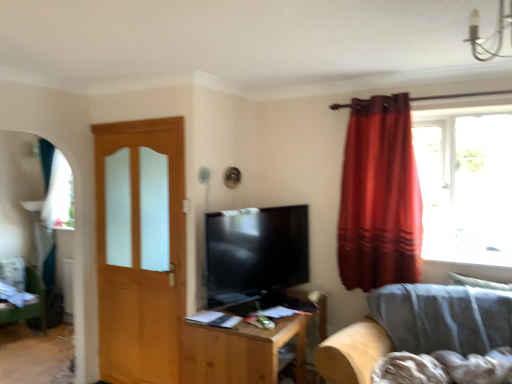
This screenshot has width=512, height=384. Describe the element at coordinates (140, 249) in the screenshot. I see `light brown wooden door at left` at that location.

Describe the element at coordinates (29, 304) in the screenshot. I see `green fabric swivel chair at lower left` at that location.

This screenshot has width=512, height=384. What do you see at coordinates (490, 35) in the screenshot?
I see `white glass chandelier at upper right` at bounding box center [490, 35].

This screenshot has height=384, width=512. What do you see at coordinates (248, 348) in the screenshot? I see `wooden table at center` at bounding box center [248, 348].

At what (x,y) coordinates should I click in order to perform the action: click on satin red curtain at right. Please return your answer as a coordinate pair (x, y). Looking at the image, I should click on (379, 196).

Consider the image. Does green fabric swivel chair at lower left turn towards satin red curtain at right?

No, green fabric swivel chair at lower left is not facing towards satin red curtain at right.

Which of these two, green fabric swivel chair at lower left or satin red curtain at right, is smaller?

Smaller between the two is satin red curtain at right.

In the scene shown: From the image's perspective, between green fabric swivel chair at lower left and satin red curtain at right, which one is located above?

satin red curtain at right.

Which object is thinner, green fabric swivel chair at lower left or satin red curtain at right?

Thinner between the two is satin red curtain at right.

Does satin red curtain at right have a greater width compared to light brown wooden door at left?

Yes.

The height and width of the screenshot is (384, 512). Find the location of `door below the satin red curtain at right (from the image's perspective)`. door below the satin red curtain at right (from the image's perspective) is located at coordinates (140, 249).

Considering the positions of point (349, 246) and point (131, 369), is point (349, 246) closer or farther from the camera than point (131, 369)?

Point (349, 246) is positioned closer to the camera compared to point (131, 369).

Measure the distance between satin red curtain at right and light brown wooden door at left.

A distance of 1.47 meters exists between satin red curtain at right and light brown wooden door at left.

Which is in front, gray fabric couch at lower right or light brown wooden door at left?

gray fabric couch at lower right is closer to the camera.

Identify the location of door behind the gray fabric couch at lower right. This screenshot has height=384, width=512. (140, 249).

Could you tell me if gray fabric couch at lower right is turned towards light brown wooden door at left?

No, gray fabric couch at lower right is not oriented towards light brown wooden door at left.

From a real-world perspective, is light brown wooden door at left positioned under matte black tv at center based on gravity?

Yes, from a real-world perspective, light brown wooden door at left is below matte black tv at center.

In the image, is light brown wooden door at left on the left side or the right side of matte black tv at center?

light brown wooden door at left is positioned on matte black tv at center's left side.

Is light brown wooden door at left spatially inside matte black tv at center, or outside of it?

The correct answer is: outside.

Measure the distance between light brown wooden door at left and matte black tv at center.

light brown wooden door at left is 25.32 inches away from matte black tv at center.

Can you confirm if gray fabric couch at lower right is wider than matte black tv at center?

Indeed, gray fabric couch at lower right has a greater width compared to matte black tv at center.

Could you tell me if gray fabric couch at lower right is facing matte black tv at center?

No, gray fabric couch at lower right is not oriented towards matte black tv at center.

In terms of height, does gray fabric couch at lower right look taller or shorter compared to matte black tv at center?

gray fabric couch at lower right is taller than matte black tv at center.

From the picture: Can you tell me how much gray fabric couch at lower right and matte black tv at center differ in facing direction?

There is a 73.2-degree angle between the facing directions of gray fabric couch at lower right and matte black tv at center.

In terms of width, does light brown wooden door at left look wider or thinner when compared to green fabric swivel chair at lower left?

Clearly, light brown wooden door at left has less width compared to green fabric swivel chair at lower left.

From a real-world perspective, does light brown wooden door at left stand above green fabric swivel chair at lower left?

Yes, from a real-world perspective, light brown wooden door at left is above green fabric swivel chair at lower left.

Considering the sizes of light brown wooden door at left and green fabric swivel chair at lower left in the image, is light brown wooden door at left taller or shorter than green fabric swivel chair at lower left?

Considering their sizes, light brown wooden door at left has more height than green fabric swivel chair at lower left.

Which point is more distant from viewer, [164,335] or [45,316]?

The point [45,316] is more distant.

From the image's perspective, between green fabric swivel chair at lower left and wooden table at center, which one is located above?

green fabric swivel chair at lower left.

From a real-world perspective, who is located lower, green fabric swivel chair at lower left or wooden table at center?

green fabric swivel chair at lower left, from a real-world perspective.

Locate an element on the screen. The image size is (512, 384). table in front of the green fabric swivel chair at lower left is located at coordinates [248, 348].

Is green fabric swivel chair at lower left wider than wooden table at center?

Incorrect, the width of green fabric swivel chair at lower left does not surpass that of wooden table at center.

Where is `swivel chair on the left of satin red curtain at right`? The height and width of the screenshot is (384, 512). swivel chair on the left of satin red curtain at right is located at coordinates (29, 304).

What are the coordinates of `curtain in front of the light brown wooden door at left` in the screenshot? It's located at (379, 196).

Based on their spatial positions, is matte black tv at center or wooden table at center further from white glass chandelier at upper right?

Among the two, wooden table at center is located further to white glass chandelier at upper right.

Considering their positions, is wooden table at center positioned further to matte black tv at center than white glass chandelier at upper right?

Based on the image, white glass chandelier at upper right appears to be further to matte black tv at center.

Based on their spatial positions, is white glass chandelier at upper right or light brown wooden door at left closer to gray fabric couch at lower right?

Based on the image, light brown wooden door at left appears to be nearer to gray fabric couch at lower right.

When comparing their distances from gray fabric couch at lower right, does matte black tv at center or green fabric swivel chair at lower left seem closer?

The object closer to gray fabric couch at lower right is matte black tv at center.

When comparing their distances from satin red curtain at right, does gray fabric couch at lower right or matte black tv at center seem further?

The object further to satin red curtain at right is matte black tv at center.

Based on their spatial positions, is light brown wooden door at left or green fabric swivel chair at lower left closer to matte black tv at center?

light brown wooden door at left is positioned closer to the anchor matte black tv at center.

Based on the photo, based on their spatial positions, is white glass chandelier at upper right or matte black tv at center further from wooden table at center?

white glass chandelier at upper right.

When comparing their distances from green fabric swivel chair at lower left, does light brown wooden door at left or white glass chandelier at upper right seem closer?

light brown wooden door at left is positioned closer to the anchor green fabric swivel chair at lower left.

At what (x,y) coordinates should I click in order to perform the action: click on curtain between white glass chandelier at upper right and wooden table at center in the up-down direction. Please return your answer as a coordinate pair (x, y). Looking at the image, I should click on (379, 196).

Where is `door between white glass chandelier at upper right and wooden table at center from top to bottom`? door between white glass chandelier at upper right and wooden table at center from top to bottom is located at coordinates (140, 249).

You are a GUI agent. You are given a task and a screenshot of the screen. Output one action in this format:
    pyautogui.click(x=<x>, y=<y>)
    Task: Click on the door between green fabric swivel chair at lower left and matte black tv at center from left to right
    This screenshot has width=512, height=384.
    Given the screenshot: What is the action you would take?
    pyautogui.click(x=140, y=249)

Image resolution: width=512 pixels, height=384 pixels. What are the coordinates of `table located between green fabric swivel chair at lower left and gray fabric couch at lower right in the left-right direction` in the screenshot? It's located at (248, 348).